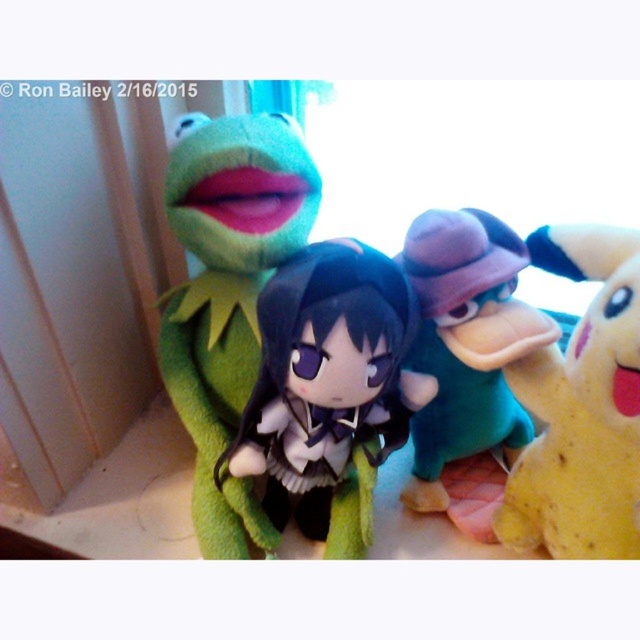
You are organizing a childrens toy store and need to arrange the yellow plush toy at right and teal plush duck at center on a shelf. The shelf has limited space, and you must place them in order from left to right based on their current positions in the image. Which toy should you place first on the left side of the shelf?

You should place the teal plush duck at center first on the left side of the shelf because in the image, the yellow plush toy at right is to the right of the teal plush duck at center, meaning the teal plush duck at center is positioned to the left of the yellow plush toy at right.